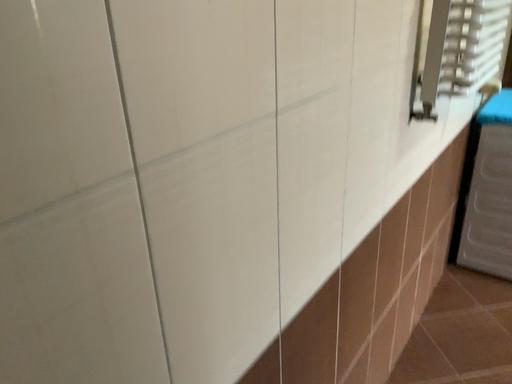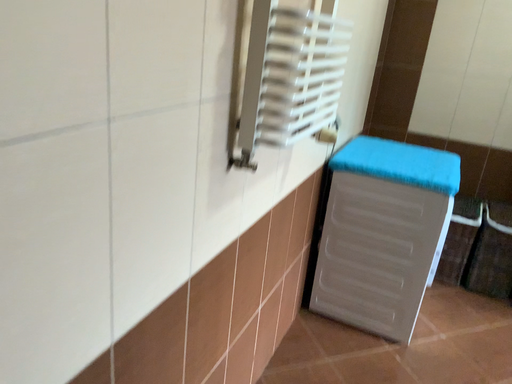
Question: Which way did the camera rotate in the video?

Choices:
 (A) rotated right
 (B) rotated left

Answer: (A)